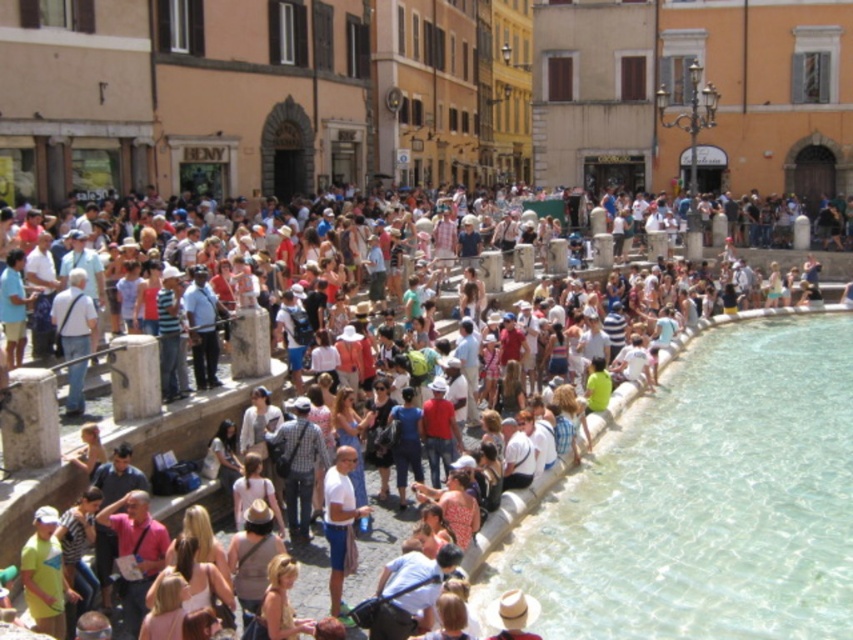
Question: Which of the following is the closest to the observer?

Choices:
 (A) (776, 456)
 (B) (386, 540)

Answer: (B)

Question: Can you confirm if clear stone pool at lower right is positioned to the right of matte stone crowd at center?

Choices:
 (A) yes
 (B) no

Answer: (A)

Question: Which point is closer to the camera taking this photo?

Choices:
 (A) (811, 385)
 (B) (36, 388)

Answer: (B)

Question: Can you confirm if clear stone pool at lower right is positioned to the left of matte stone crowd at center?

Choices:
 (A) yes
 (B) no

Answer: (B)

Question: Where is clear stone pool at lower right located in relation to matte stone crowd at center in the image?

Choices:
 (A) below
 (B) above

Answer: (A)